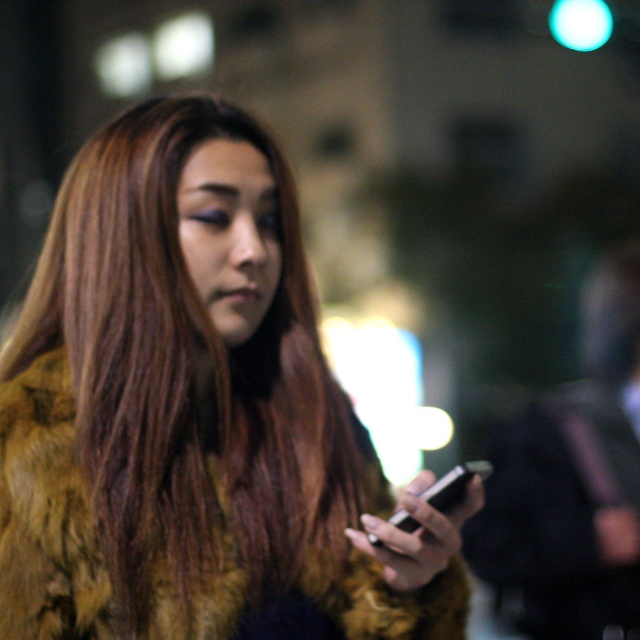
You are a photographer trying to capture a closeup of the black glossy smartphone at lower center without including the fur coat at center in the frame. Based on their positions, do you think this is possible?

The fur coat at center might be wider than black glossy smartphone at lower center, so it might be challenging to capture the smartphone without including the fur coat in the frame.

You are a photographer trying to capture the fur coat at center and the black glossy smartphone at lower center in the same frame. Based on their positions, which object should you adjust your camera focus on first to ensure both are in focus?

The fur coat at center is to the left of the black glossy smartphone at lower center. To ensure both are in focus, adjust the camera focus on the fur coat at center first since it is closer to the camera, allowing the depth of field to cover the smartphone at lower center.